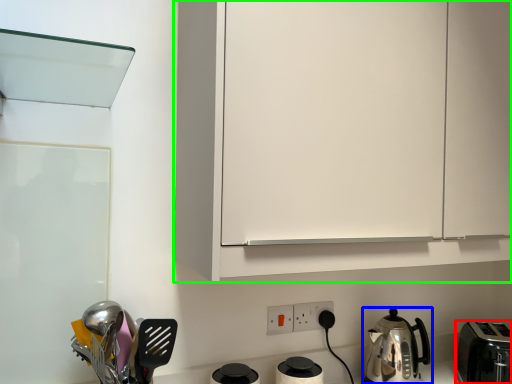
Question: Estimate the real-world distances between objects in this image. Which object is farther from toaster (highlighted by a red box), kitchen appliance (highlighted by a blue box) or cabinetry (highlighted by a green box)?

Choices:
 (A) kitchen appliance
 (B) cabinetry

Answer: (B)